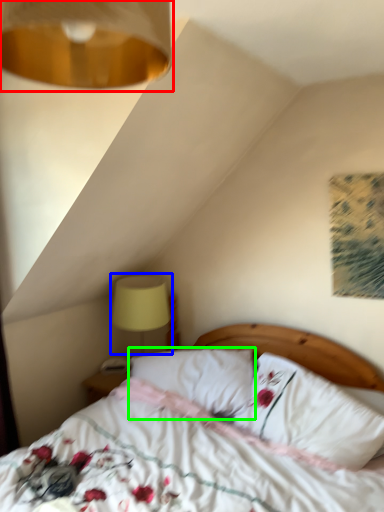
Question: Considering the real-world distances, which object is farthest from lamp (highlighted by a red box)? table lamp (highlighted by a blue box) or pillow (highlighted by a green box)?

Choices:
 (A) table lamp
 (B) pillow

Answer: (A)